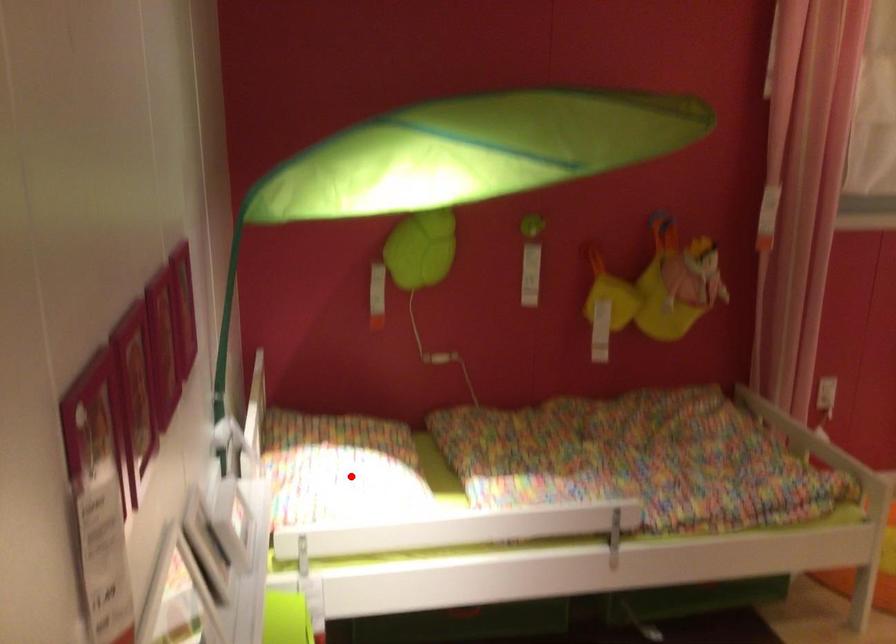
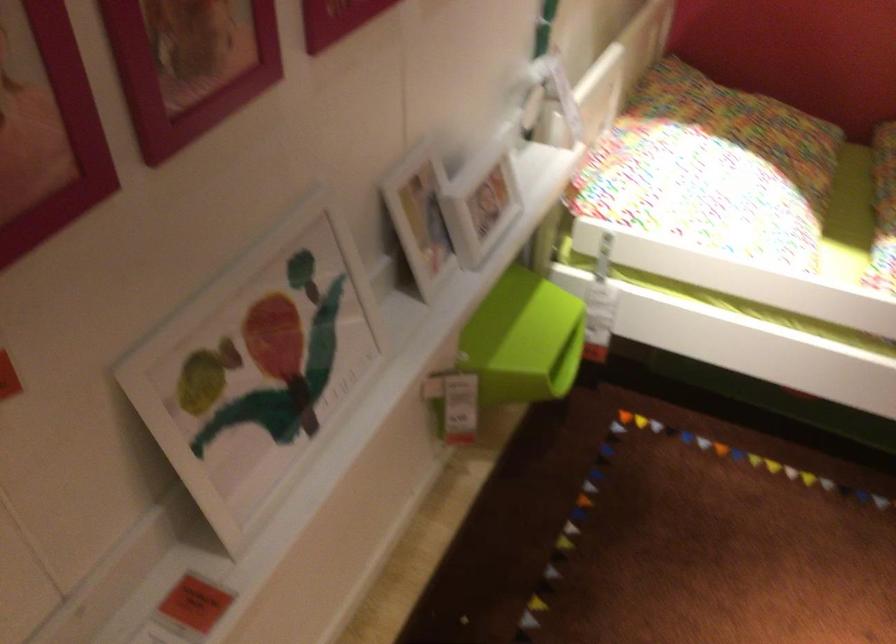
Locate, in the second image, the point that corresponds to the highlighted location in the first image.

(712, 169)